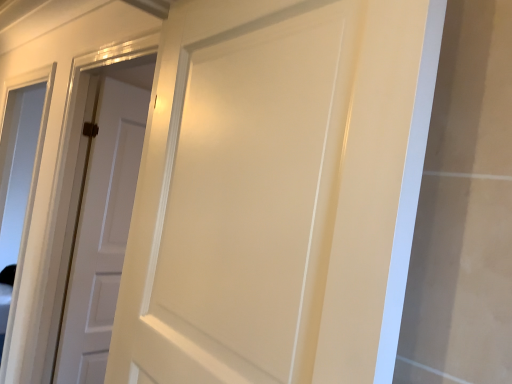
Question: Which direction should I rotate to face white matte door at center, marked as the 1th door in a left-to-right arrangement, — up or down?

Choices:
 (A) up
 (B) down

Answer: (B)

Question: From the image's perspective, is matte white door at center, acting as the second door starting from the left, beneath transparent glass window at left?

Choices:
 (A) no
 (B) yes

Answer: (A)

Question: From a real-world perspective, is matte white door at center, acting as the first door starting from the front, located beneath transparent glass window at left?

Choices:
 (A) yes
 (B) no

Answer: (B)

Question: Is matte white door at center, acting as the second door starting from the left, wider than transparent glass window at left?

Choices:
 (A) yes
 (B) no

Answer: (A)

Question: Is matte white door at center, acting as the second door starting from the left, aimed at transparent glass window at left?

Choices:
 (A) no
 (B) yes

Answer: (A)

Question: Does matte white door at center, acting as the second door starting from the left, touch transparent glass window at left?

Choices:
 (A) no
 (B) yes

Answer: (A)

Question: Is matte white door at center, marked as the first door in a right-to-left arrangement, located outside transparent glass window at left?

Choices:
 (A) no
 (B) yes

Answer: (B)

Question: Is white matte door at center, which is the 1th door from back to front, at the back of matte white door at center, positioned as the 2th door in back-to-front order?

Choices:
 (A) yes
 (B) no

Answer: (B)

Question: From the image's perspective, is matte white door at center, positioned as the 2th door in back-to-front order, on top of white matte door at center, which is the 1th door from back to front?

Choices:
 (A) no
 (B) yes

Answer: (B)

Question: Does matte white door at center, positioned as the 2th door in back-to-front order, turn towards white matte door at center, the second door when ordered from front to back?

Choices:
 (A) yes
 (B) no

Answer: (B)

Question: Can you confirm if matte white door at center, marked as the first door in a right-to-left arrangement, is positioned to the right of white matte door at center, the second door when ordered from front to back?

Choices:
 (A) yes
 (B) no

Answer: (A)

Question: Can white matte door at center, the second door when ordered from front to back, be found inside matte white door at center, acting as the second door starting from the left?

Choices:
 (A) yes
 (B) no

Answer: (B)

Question: Is matte white door at center, marked as the first door in a right-to-left arrangement, at the left side of white matte door at center, which is the 1th door from back to front?

Choices:
 (A) no
 (B) yes

Answer: (A)

Question: From a real-world perspective, is transparent glass window at left over matte white door at center, marked as the first door in a right-to-left arrangement?

Choices:
 (A) no
 (B) yes

Answer: (A)